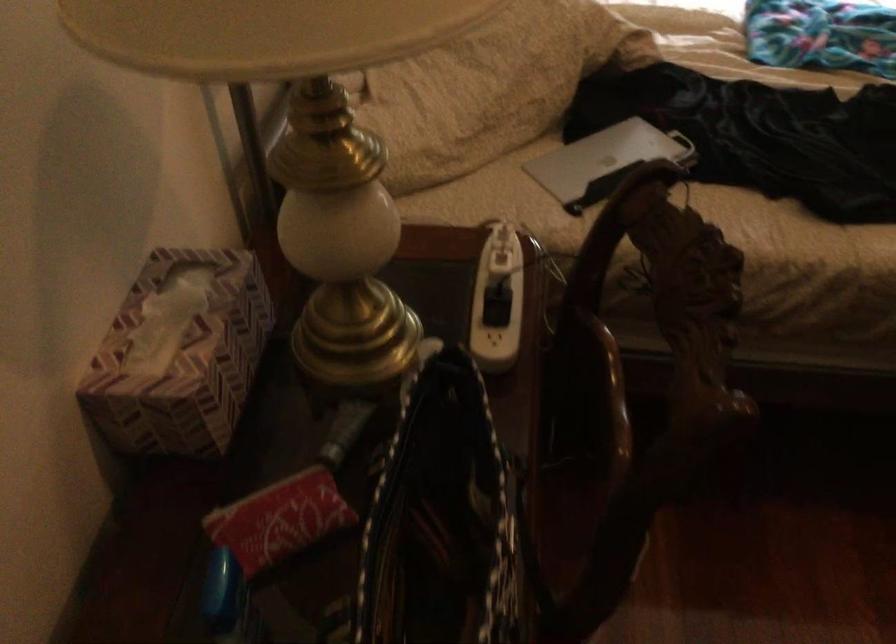
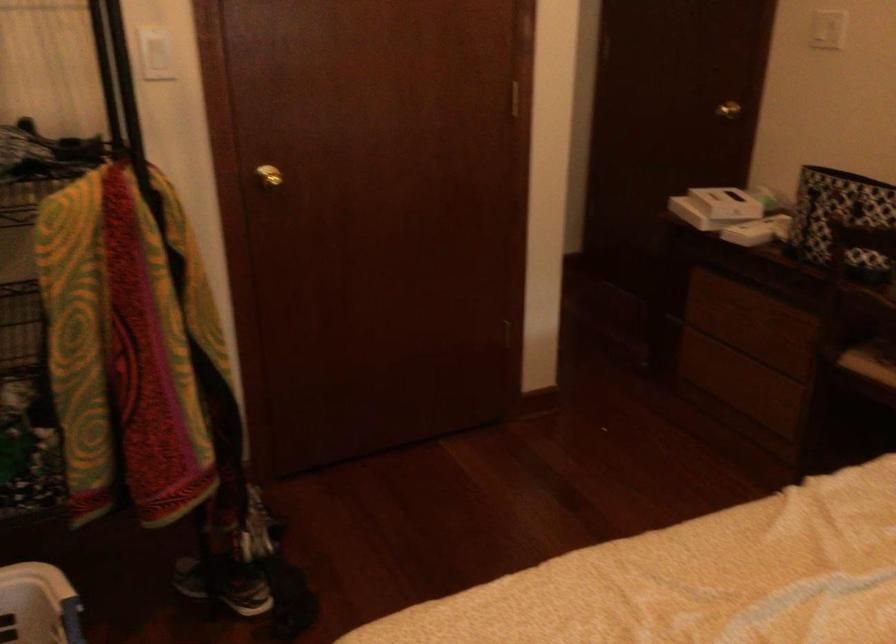
Find the pixel in the second image that matches (709,383) in the first image.

(840, 218)